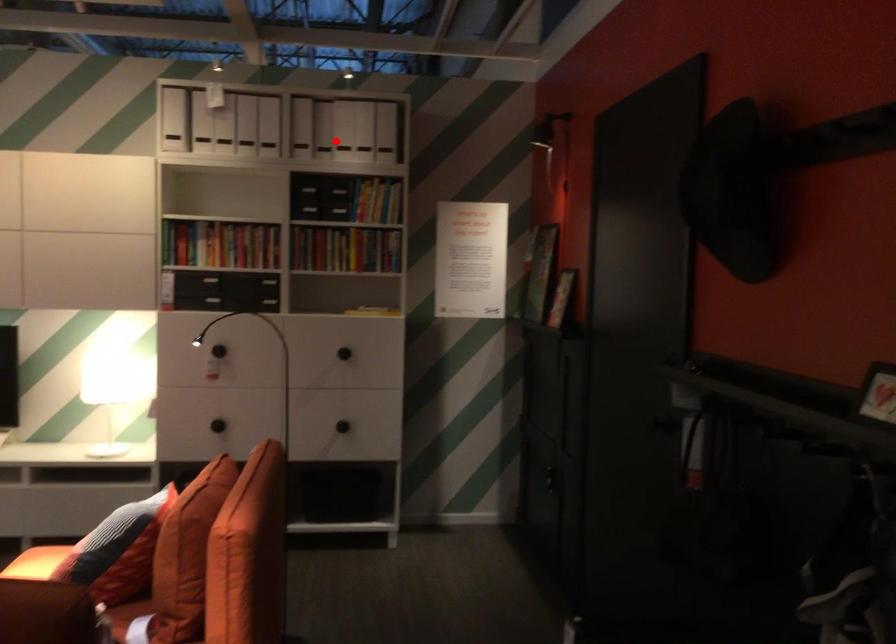
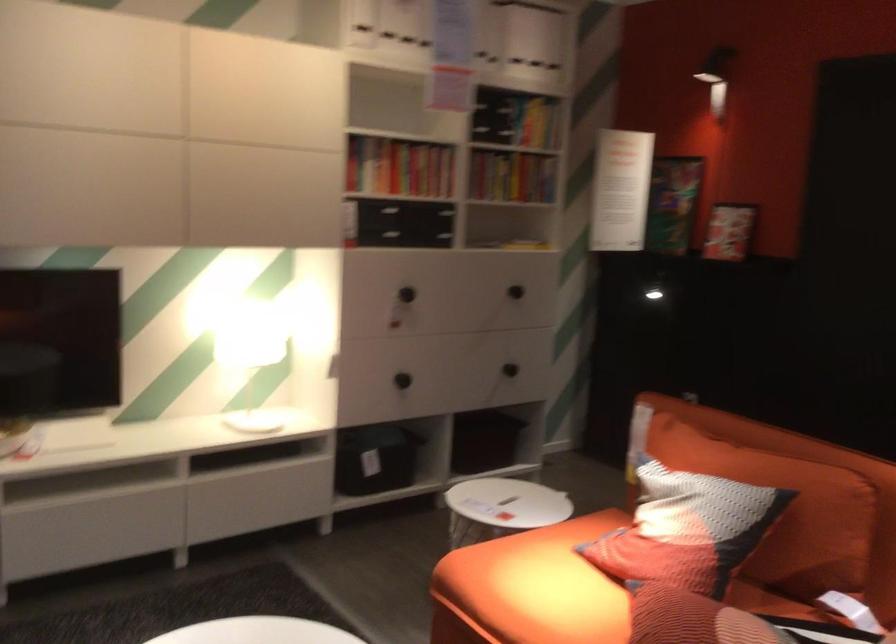
Where in the second image is the point corresponding to the highlighted location from the first image?

(536, 43)